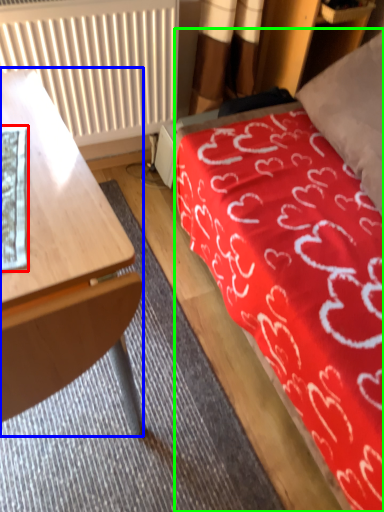
Question: Considering the real-world distances, which object is closest to sheet (highlighted by a red box)? desk (highlighted by a blue box) or bed (highlighted by a green box).

Choices:
 (A) desk
 (B) bed

Answer: (A)